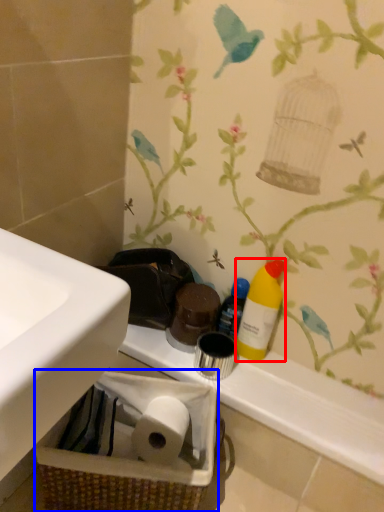
Question: Which of the following is the closest to the observer, cleaning product (highlighted by a red box) or basket container (highlighted by a blue box)?

Choices:
 (A) cleaning product
 (B) basket container

Answer: (B)